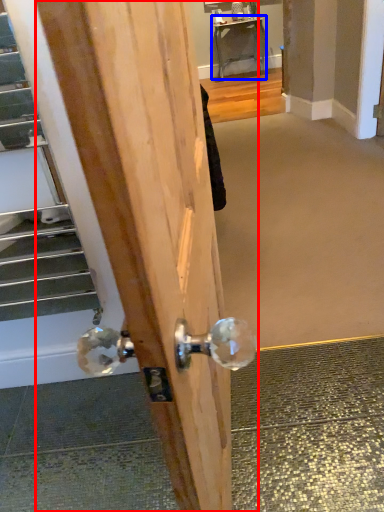
Question: Which object appears closest to the camera in this image, door (highlighted by a red box) or table (highlighted by a blue box)?

Choices:
 (A) door
 (B) table

Answer: (A)